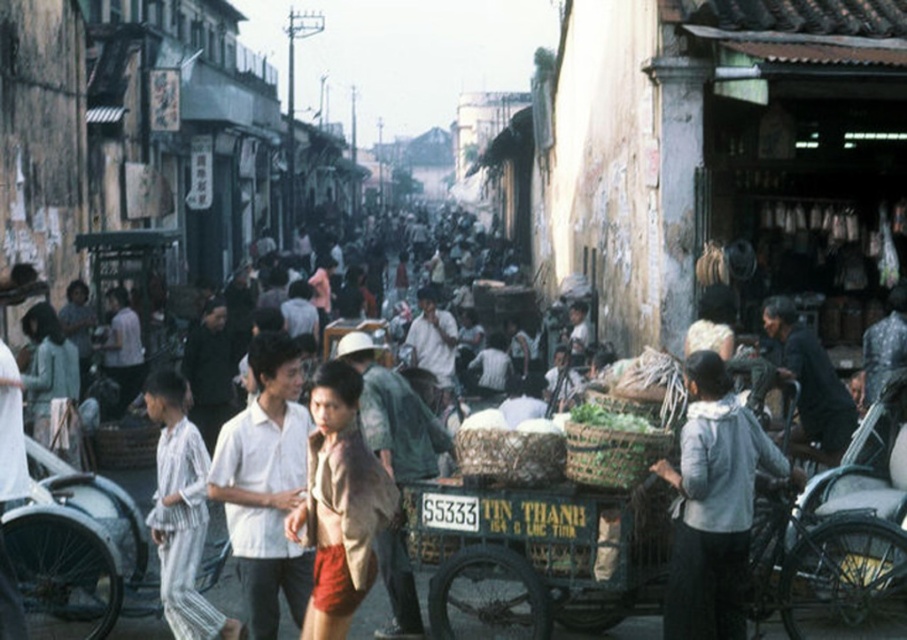
You are a delivery person standing at the edge of the street. You see a light gray fabric at lower right and a dark green fabric shirt at center. Which fabric is closer to the ground?

The light gray fabric at lower right is below the dark green fabric shirt at center, so it is closer to the ground.

You are a delivery person trying to navigate through the crowded street. You see a light gray fabric at lower right and a dark green fabric shirt at center. Which fabric is wider in width?

The light gray fabric at lower right is wider than the dark green fabric shirt at center.